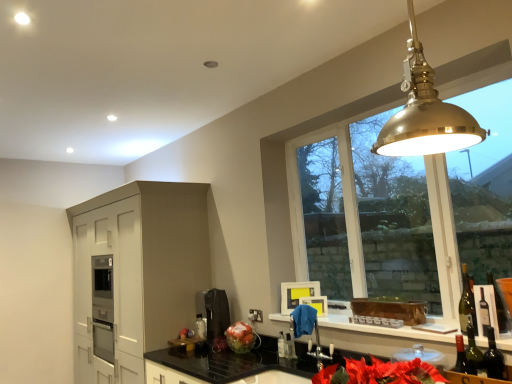
Question: Should I look upward or downward to see black matte coffee machine at center?

Choices:
 (A) up
 (B) down

Answer: (B)

Question: From a real-world perspective, does metallic silver faucet at lower center sit lower than translucent glass bottle at lower center?

Choices:
 (A) yes
 (B) no

Answer: (B)

Question: Does metallic silver faucet at lower center touch translucent glass bottle at lower center?

Choices:
 (A) no
 (B) yes

Answer: (A)

Question: Does metallic silver faucet at lower center have a lesser width compared to translucent glass bottle at lower center?

Choices:
 (A) yes
 (B) no

Answer: (B)

Question: Is metallic silver faucet at lower center further to camera compared to translucent glass bottle at lower center?

Choices:
 (A) yes
 (B) no

Answer: (B)

Question: Considering the relative positions of metallic silver faucet at lower center and translucent glass bottle at lower center in the image provided, is metallic silver faucet at lower center to the right of translucent glass bottle at lower center from the viewer's perspective?

Choices:
 (A) yes
 (B) no

Answer: (A)

Question: Can you confirm if metallic silver faucet at lower center is bigger than translucent glass bottle at lower center?

Choices:
 (A) yes
 (B) no

Answer: (A)

Question: Is metallic silver faucet at lower center positioned with its back to white glossy window sill at lower center?

Choices:
 (A) yes
 (B) no

Answer: (B)

Question: From a real-world perspective, is metallic silver faucet at lower center on white glossy window sill at lower center?

Choices:
 (A) no
 (B) yes

Answer: (A)

Question: Does metallic silver faucet at lower center have a greater height compared to white glossy window sill at lower center?

Choices:
 (A) yes
 (B) no

Answer: (A)

Question: Is metallic silver faucet at lower center further to camera compared to white glossy window sill at lower center?

Choices:
 (A) yes
 (B) no

Answer: (A)

Question: Does metallic silver faucet at lower center contain white glossy window sill at lower center?

Choices:
 (A) no
 (B) yes

Answer: (A)

Question: Is metallic silver faucet at lower center to the left of white glossy window sill at lower center from the viewer's perspective?

Choices:
 (A) no
 (B) yes

Answer: (B)

Question: Considering the relative positions of green glass wine bottle at right, acting as the first wine bottle starting from the back, and green glass wine bottle at lower right, the third wine bottle from the back, in the image provided, is green glass wine bottle at right, acting as the first wine bottle starting from the back, to the left of green glass wine bottle at lower right, the third wine bottle from the back, from the viewer's perspective?

Choices:
 (A) no
 (B) yes

Answer: (A)